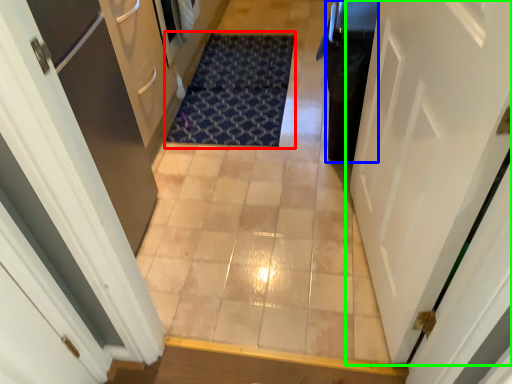
Question: Estimate the real-world distances between objects in this image. Which object is farther from doormat (highlighted by a red box), dark (highlighted by a blue box) or door (highlighted by a green box)?

Choices:
 (A) dark
 (B) door

Answer: (B)